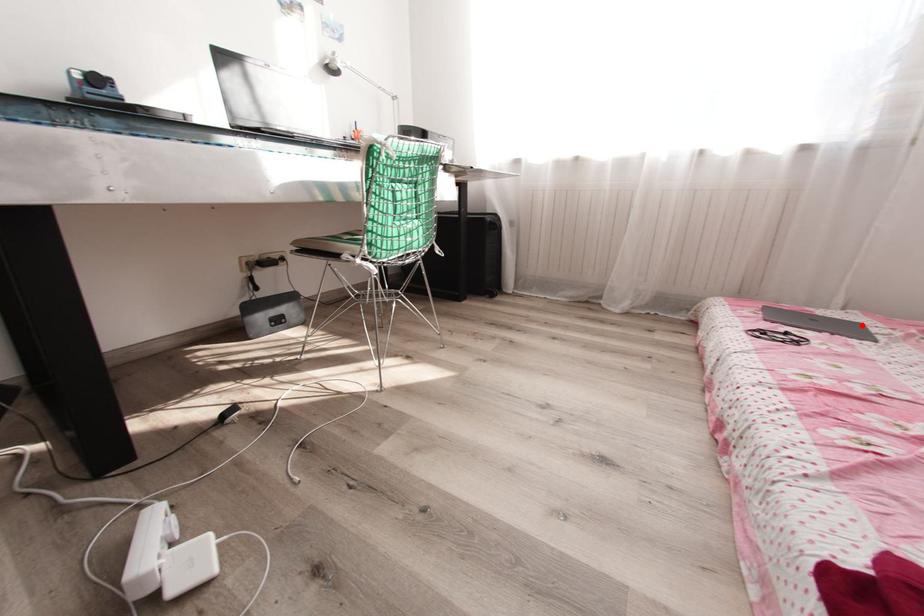
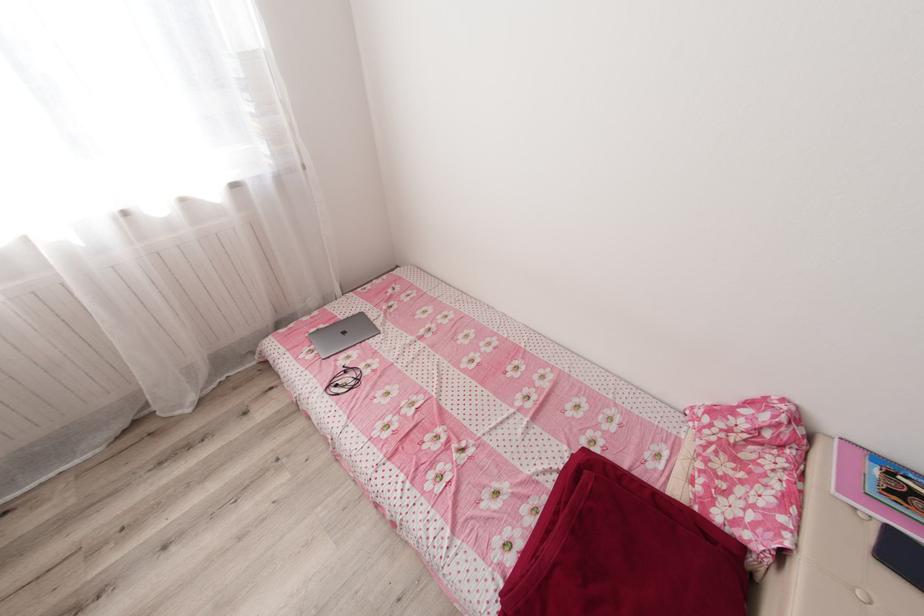
Locate, in the second image, the point that corresponds to the highlighted location in the first image.

(367, 315)